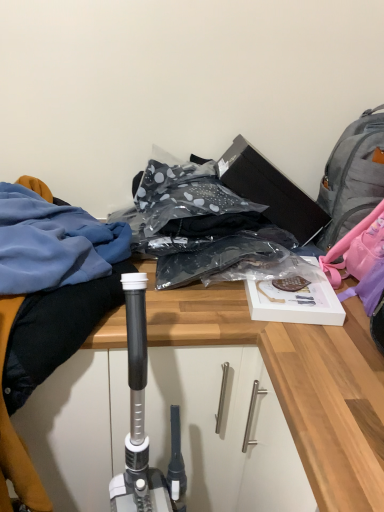
Question: Considering the positions of wooden desk at center and blue fabric at left in the image, is wooden desk at center bigger or smaller than blue fabric at left?

Choices:
 (A) small
 (B) big

Answer: (A)

Question: Is point pyautogui.click(x=205, y=501) positioned closer to the camera than point pyautogui.click(x=13, y=485)?

Choices:
 (A) closer
 (B) farther

Answer: (B)

Question: Which of these objects is positioned farthest from the gray fabric backpack at upper right?

Choices:
 (A) wooden desk at center
 (B) blue fabric at left

Answer: (B)

Question: Estimate the real-world distances between objects in this image. Which object is closer to the blue fabric at left?

Choices:
 (A) gray fabric backpack at upper right
 (B) wooden desk at center

Answer: (B)